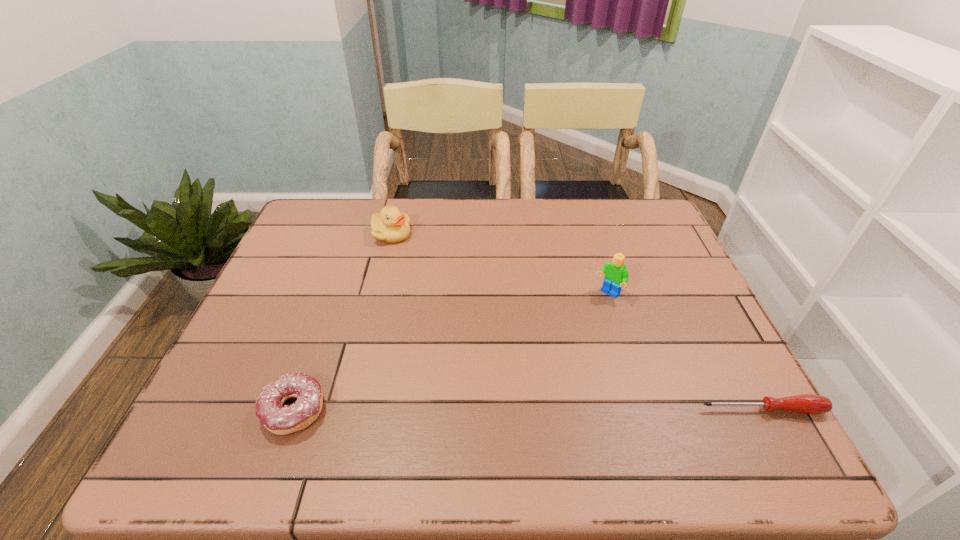
Where is `vacant area located on the face of the second farthest object`? The width and height of the screenshot is (960, 540). vacant area located on the face of the second farthest object is located at coordinates (558, 351).

Where is `vacant region located 0.280m on the front-facing side of the farthest object`? vacant region located 0.280m on the front-facing side of the farthest object is located at coordinates (427, 307).

Where is `free space located 0.070m on the front-facing side of the farthest object`? Image resolution: width=960 pixels, height=540 pixels. free space located 0.070m on the front-facing side of the farthest object is located at coordinates (403, 259).

The width and height of the screenshot is (960, 540). I want to click on vacant position located 0.200m on the front-facing side of the farthest object, so click(418, 287).

Identify the location of object that is at the far edge. The width and height of the screenshot is (960, 540). (391, 226).

At what (x,y) coordinates should I click in order to perform the action: click on doughnut situated at the near edge. Please return your answer as a coordinate pair (x, y). The height and width of the screenshot is (540, 960). Looking at the image, I should click on pos(281,420).

I want to click on screwdriver that is at the near edge, so click(x=807, y=403).

The width and height of the screenshot is (960, 540). I want to click on object at the left edge, so click(x=281, y=420).

You are a GUI agent. You are given a task and a screenshot of the screen. Output one action in this format:
    pyautogui.click(x=<x>, y=<y>)
    Task: Click on the object situated at the right edge
    The height and width of the screenshot is (540, 960).
    Given the screenshot: What is the action you would take?
    pyautogui.click(x=807, y=403)

At what (x,y) coordinates should I click in order to perform the action: click on object that is at the near left corner. Please return your answer as a coordinate pair (x, y). Looking at the image, I should click on (281, 420).